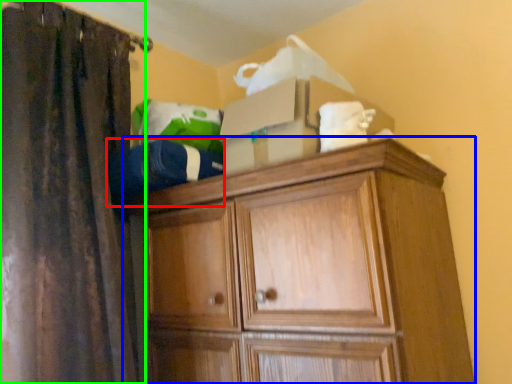
Question: Which object is positioned closest to clothing (highlighted by a red box)? Select from cupboard (highlighted by a blue box) and curtain (highlighted by a green box).

Choices:
 (A) cupboard
 (B) curtain

Answer: (B)